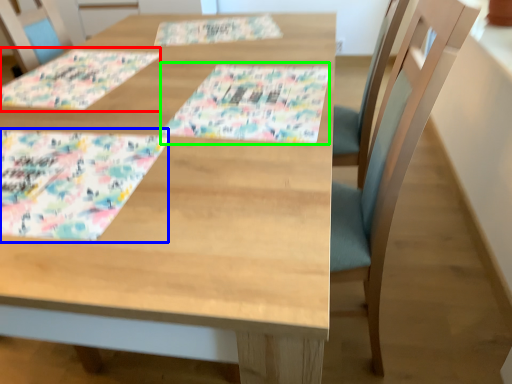
Question: Considering the real-world distances, which object is closest to place mat (highlighted by a red box)? place mat (highlighted by a blue box) or tablecloth (highlighted by a green box).

Choices:
 (A) place mat
 (B) tablecloth

Answer: (A)